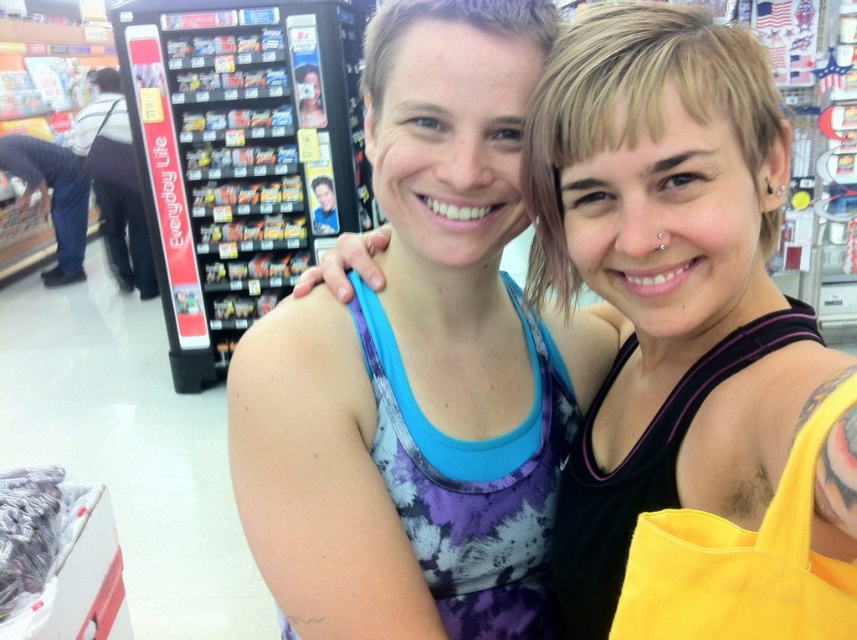
Question: Among these points, which one is farthest from the camera?

Choices:
 (A) (843, 380)
 (B) (637, 605)

Answer: (B)

Question: Which of the following is the farthest from the observer?

Choices:
 (A) purple tie-dye tank top at center
 (B) yellow fabric bag at lower right

Answer: (B)

Question: Where is purple tie-dye tank top at center located in relation to yellow fabric bag at lower right in the image?

Choices:
 (A) left
 (B) right

Answer: (A)

Question: Can you confirm if purple tie-dye tank top at center is positioned above yellow fabric bag at lower right?

Choices:
 (A) yes
 (B) no

Answer: (A)

Question: Where is purple tie-dye tank top at center located in relation to yellow fabric bag at lower right in the image?

Choices:
 (A) right
 (B) left

Answer: (B)